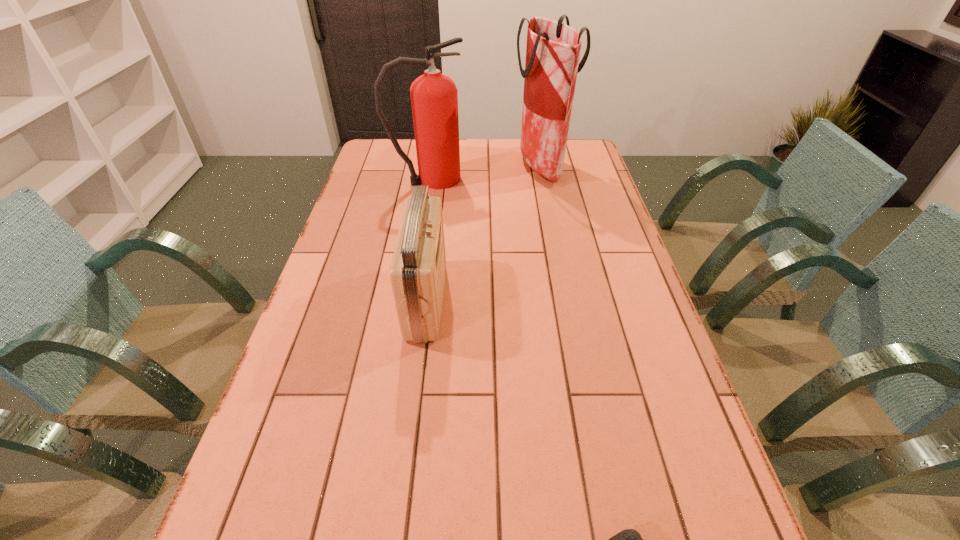
Identify the location of grocery bag. The height and width of the screenshot is (540, 960). (553, 49).

You are a GUI agent. You are given a task and a screenshot of the screen. Output one action in this format:
    pyautogui.click(x=<x>, y=<y>)
    Task: Click on the fire extinguisher
    
    Given the screenshot: What is the action you would take?
    pyautogui.click(x=434, y=97)

Locate an element on the screen. This screenshot has height=540, width=960. radio receiver is located at coordinates (417, 273).

You are a GUI agent. You are given a task and a screenshot of the screen. Output one action in this format:
    pyautogui.click(x=<x>, y=<y>)
    Task: Click on the second shortest object
    Image resolution: width=960 pixels, height=540 pixels.
    Given the screenshot: What is the action you would take?
    pyautogui.click(x=417, y=273)

Identify the location of free location located 0.150m on the left of the grocery bag. Image resolution: width=960 pixels, height=540 pixels. (471, 167).

Find the location of a particular element. The height and width of the screenshot is (540, 960). vacant space located on the handle side of the fire extinguisher is located at coordinates (516, 179).

Identify the location of free region located on the front-facing side of the second nearest object. This screenshot has width=960, height=540. (551, 300).

Identify the location of grocery bag located in the far edge section of the desktop. (553, 49).

Locate an element on the screen. fire extinguisher situated at the far edge is located at coordinates (434, 97).

What are the coordinates of `object located in the left edge section of the desktop` in the screenshot? It's located at (434, 97).